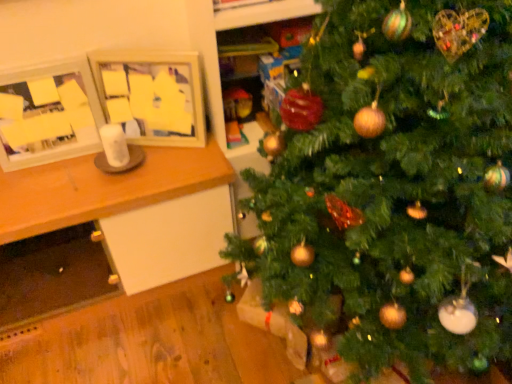
Find the location of a particular element. vacant space situated above wooden table at left (from a real-world perspective) is located at coordinates (76, 165).